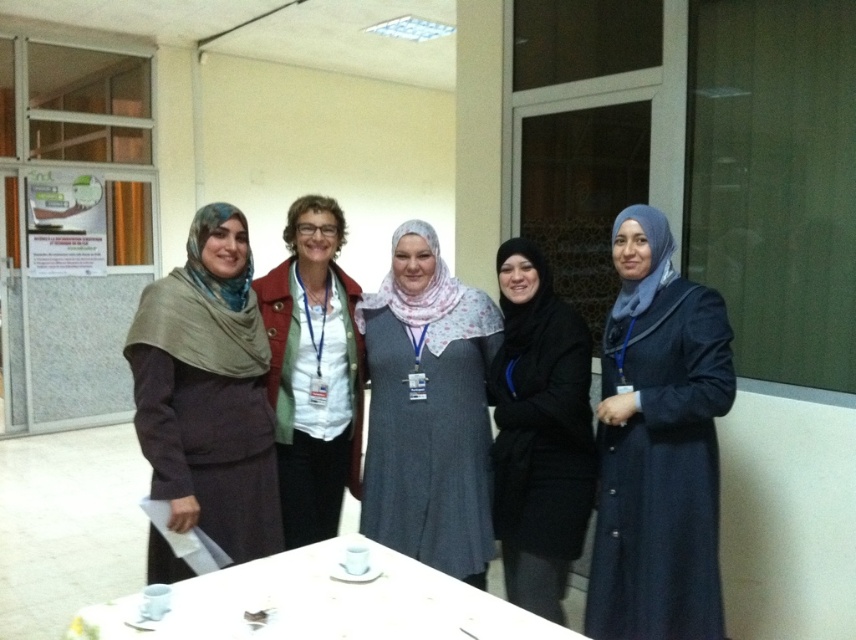
You are standing in front of a group photo and want to know which item is closer to you between the gray fabric dress at center and the black matte hijab at center. Which one is closer?

The gray fabric dress at center is closer to you than the black matte hijab at center.

You are standing in the room and see the matte brown scarf at center and the white glossy table at lower center. Which object is closer to you?

The matte brown scarf at center is closer to you because it is located above the white glossy table at lower center, meaning it is positioned nearer in the visual plane.

Which object is located at the coordinates point (207, 392)?

The matte brown scarf at center is located at point (207, 392).